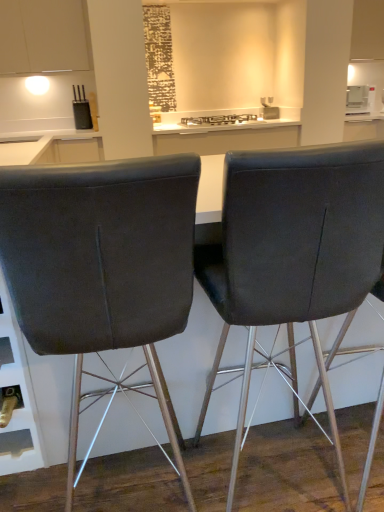
Question: Is metallic silver gas stove at center at the right side of matte black chair at center, the 1th chair from the right?

Choices:
 (A) no
 (B) yes

Answer: (B)

Question: Are metallic silver gas stove at center and matte black chair at center, the 1th chair from the right, making contact?

Choices:
 (A) no
 (B) yes

Answer: (A)

Question: Can you confirm if metallic silver gas stove at center is shorter than matte black chair at center, the 1th chair from the right?

Choices:
 (A) no
 (B) yes

Answer: (B)

Question: Is metallic silver gas stove at center facing towards matte black chair at center, placed as the 2th chair when sorted from left to right?

Choices:
 (A) yes
 (B) no

Answer: (B)

Question: Is matte black chair at center, the 1th chair from the right, inside metallic silver gas stove at center?

Choices:
 (A) no
 (B) yes

Answer: (A)

Question: Considering the positions of matte black chair at center, placed as the 2th chair when sorted from left to right, and dark gray fabric chair at center, which is the 1th chair in left-to-right order, in the image, is matte black chair at center, placed as the 2th chair when sorted from left to right, taller or shorter than dark gray fabric chair at center, which is the 1th chair in left-to-right order,?

Choices:
 (A) tall
 (B) short

Answer: (B)

Question: Is matte black chair at center, the 1th chair from the right, situated inside dark gray fabric chair at center, which is the 1th chair in left-to-right order, or outside?

Choices:
 (A) inside
 (B) outside

Answer: (B)

Question: From the image's perspective, relative to dark gray fabric chair at center, which is the 1th chair in left-to-right order, is matte black chair at center, the 1th chair from the right, above or below?

Choices:
 (A) below
 (B) above

Answer: (B)

Question: Does point (273, 233) appear closer or farther from the camera than point (175, 159)?

Choices:
 (A) closer
 (B) farther

Answer: (B)

Question: Does point (347, 108) appear closer or farther from the camera than point (39, 35)?

Choices:
 (A) farther
 (B) closer

Answer: (A)

Question: In terms of height, does white glossy microwave at upper right look taller or shorter compared to white matte cabinet at upper left?

Choices:
 (A) short
 (B) tall

Answer: (A)

Question: From the image's perspective, is white glossy microwave at upper right positioned above or below white matte cabinet at upper left?

Choices:
 (A) below
 (B) above

Answer: (A)

Question: From a real-world perspective, is white glossy microwave at upper right physically located above or below white matte cabinet at upper left?

Choices:
 (A) below
 (B) above

Answer: (A)

Question: Does point (218, 124) appear closer or farther from the camera than point (147, 249)?

Choices:
 (A) closer
 (B) farther

Answer: (B)

Question: Is metallic silver gas stove at center situated inside dark gray fabric chair at center, which is the 1th chair in left-to-right order, or outside?

Choices:
 (A) outside
 (B) inside

Answer: (A)